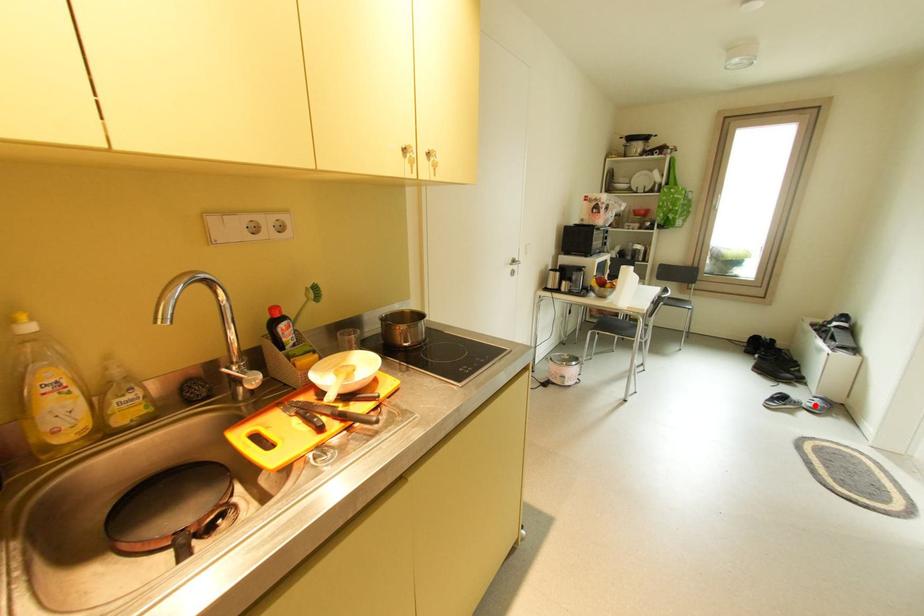
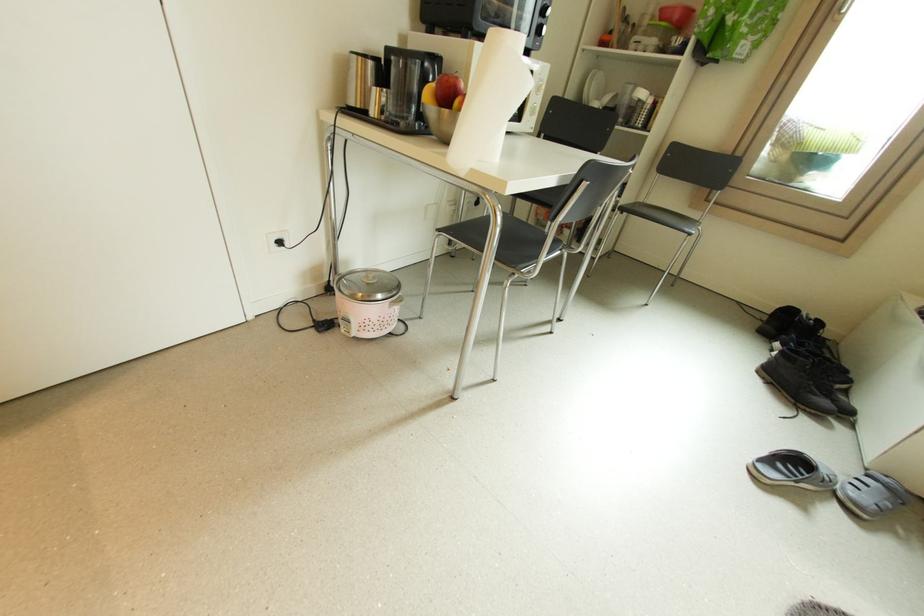
Locate, in the second image, the point that corresponds to the highlighted location in the first image.

(858, 495)